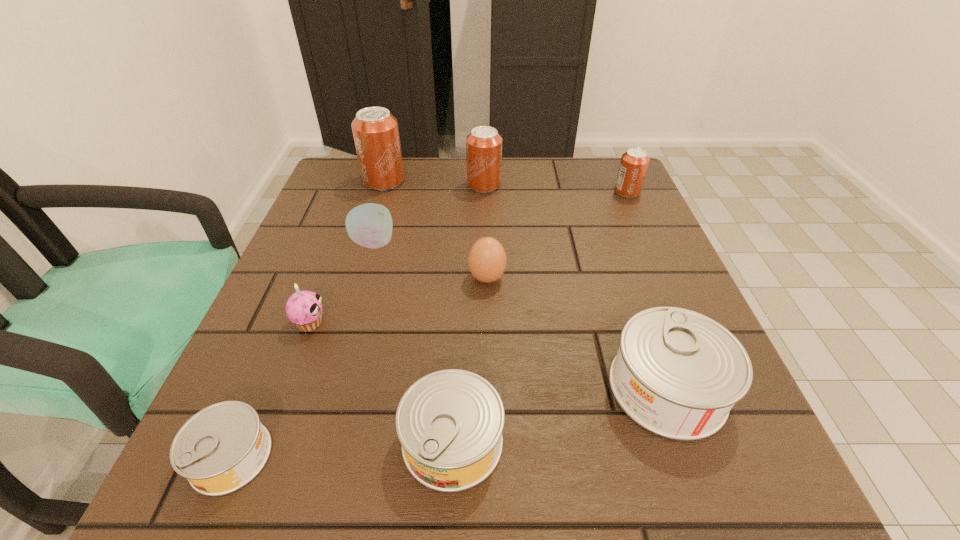
Image resolution: width=960 pixels, height=540 pixels. What are the coordinates of `the biggest silver can` in the screenshot? It's located at (677, 373).

You are a GUI agent. You are given a task and a screenshot of the screen. Output one action in this format:
    pyautogui.click(x=<x>, y=<y>)
    Task: Click on the second biggest silver can
    This screenshot has width=960, height=540.
    Given the screenshot: What is the action you would take?
    pyautogui.click(x=450, y=423)

Where is `the second silver can from right to left`? Image resolution: width=960 pixels, height=540 pixels. the second silver can from right to left is located at coordinates (450, 423).

Locate an element on the screen. This screenshot has width=960, height=540. the shortest object is located at coordinates (223, 447).

Where is `the smallest silver can`? the smallest silver can is located at coordinates (223, 447).

Locate an element on the screen. The image size is (960, 540). free space located on the right of the tallest can is located at coordinates (556, 181).

Find the location of a particular element. vacant space located on the left of the second tallest object is located at coordinates (424, 185).

I want to click on free spot located 0.150m on the left of the smallest orange can, so click(x=554, y=192).

The image size is (960, 540). Identify the location of vacant space positioned on the left of the fifth nearest object. (403, 278).

Identify the location of vacant area located on the front of the white apple. (328, 402).